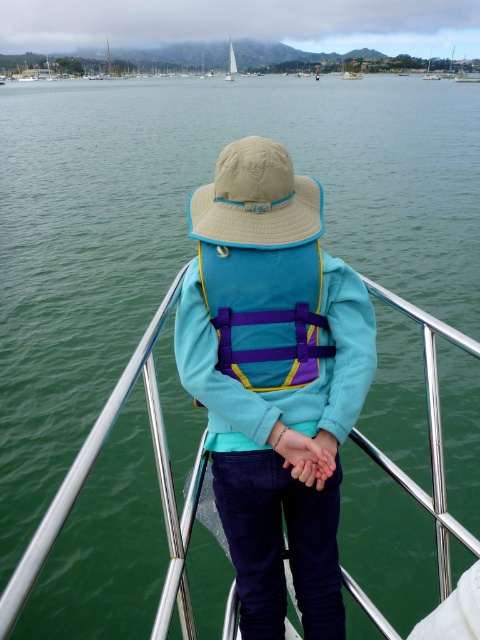
Question: Observing the image, what is the correct spatial positioning of white wooden sailboat at center in reference to white glossy sailboat at center?

Choices:
 (A) above
 (B) below

Answer: (A)

Question: Among these objects, which one is nearest to the camera?

Choices:
 (A) white sailboat at center
 (B) beige fabric hat at center
 (C) matte blue life jacket at center
 (D) white plastic boat at center

Answer: (B)

Question: Is white wooden sailboat at center to the right of white glossy sailboat at center from the viewer's perspective?

Choices:
 (A) yes
 (B) no

Answer: (A)

Question: Which point is closer to the camera?

Choices:
 (A) (423, 77)
 (B) (348, 77)

Answer: (B)

Question: Considering the relative positions of matte blue life vest at center and beige fabric hat at center in the image provided, where is matte blue life vest at center located with respect to beige fabric hat at center?

Choices:
 (A) below
 (B) above

Answer: (A)

Question: Which point is farther from the camera taking this photo?

Choices:
 (A) (325, 388)
 (B) (430, 54)
 (C) (303, 301)
 (D) (346, 76)

Answer: (B)